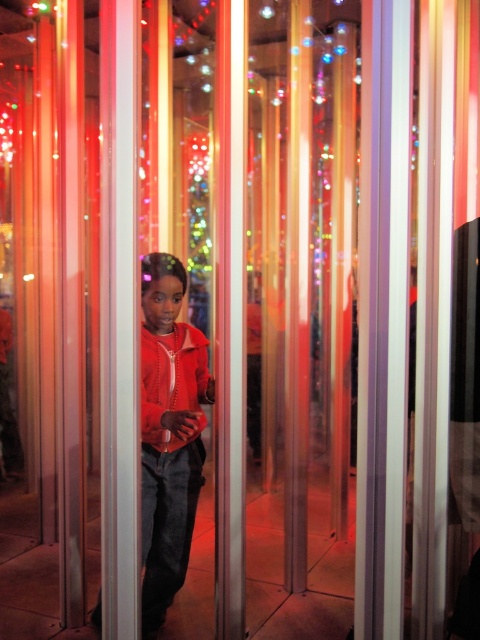
Question: Is matte orange jacket at center positioned in front of matte red sweatshirt at center?

Choices:
 (A) no
 (B) yes

Answer: (A)

Question: Does matte orange jacket at center have a smaller size compared to matte red sweatshirt at center?

Choices:
 (A) no
 (B) yes

Answer: (A)

Question: Is matte orange jacket at center smaller than matte red sweatshirt at center?

Choices:
 (A) no
 (B) yes

Answer: (A)

Question: Which point is closer to the camera?

Choices:
 (A) (145, 422)
 (B) (176, 449)

Answer: (A)

Question: Among these points, which one is nearest to the camera?

Choices:
 (A) (194, 435)
 (B) (183, 554)

Answer: (A)